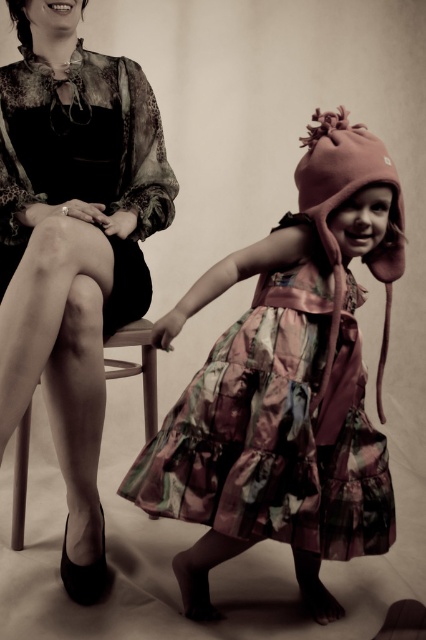
You are a photographer setting up a photoshoot. You have two dresses to feature in the image. The matte black dress at left and the shiny floral dress at center. According to the scene description, which dress is closer to the camera?

The matte black dress at left is in front of the shiny floral dress at center, so it is closer to the camera.

In the scene shown: You are standing in front of the image and want to know which of the two points, point (80,436) or point (123,337), is closer to you. Based on the scene description, can you determine this?

Point (80,436) is in front of point (123,337), so it is closer to you.

You are a fashion designer observing the scene and need to determine which object is wider between the matte black dress at left and the wooden chair at left. Based on the description, which one is wider?

The matte black dress at left is wider than the wooden chair at left according to the description.